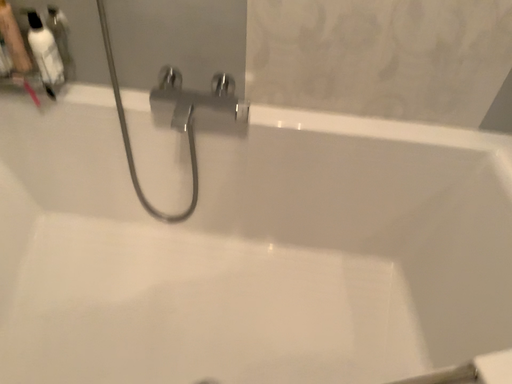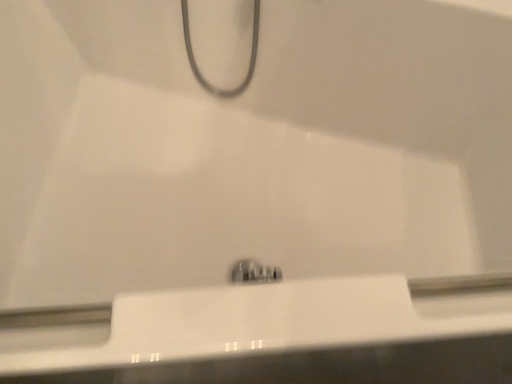
Question: Which way did the camera rotate in the video?

Choices:
 (A) rotated upward
 (B) rotated downward

Answer: (B)